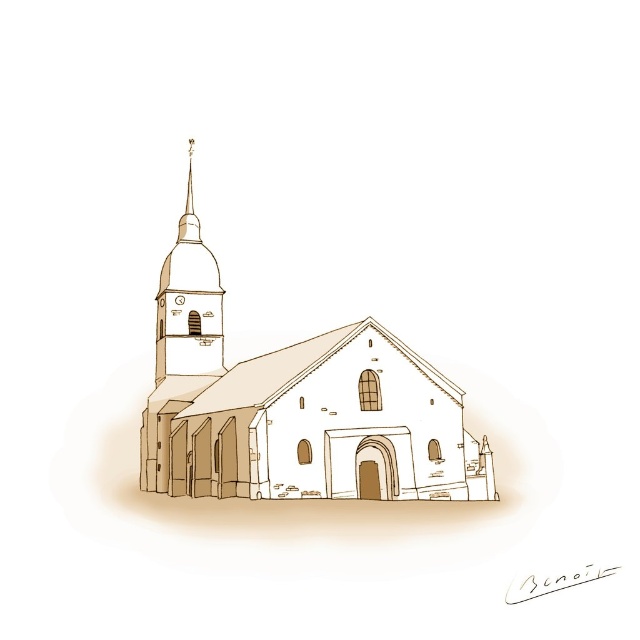
From the picture: You are an architect examining the vintage church sketch. You need to determine the spatial relationship between the brown textured church at center and the smooth beige spire at upper left. Which one is positioned higher in the image?

The smooth beige spire at upper left is positioned higher than the brown textured church at center.

You are a visitor standing in front of the brown textured church at center and want to take a photo of the smooth beige spire at upper left. Since the spire is shorter than the church, will you need to tilt your camera upwards or downwards to capture it in the frame?

The brown textured church at center is much taller than the smooth beige spire at upper left. Therefore, to capture the smooth beige spire at upper left, you would need to tilt your camera downwards since it is shorter in height compared to the church.